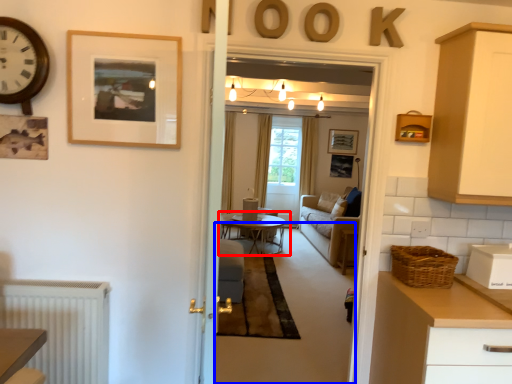
Question: Which of the following is the closest to the observer, coffee table (highlighted by a red box) or plain (highlighted by a blue box)?

Choices:
 (A) coffee table
 (B) plain

Answer: (B)